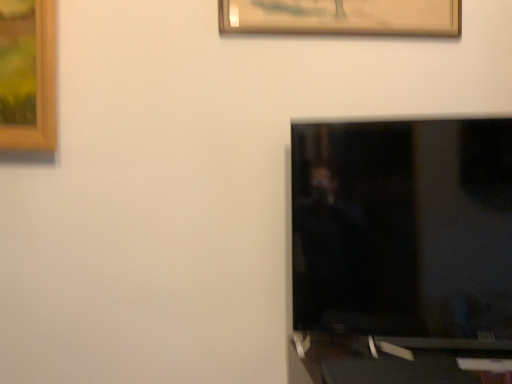
Image resolution: width=512 pixels, height=384 pixels. In order to click on black glossy tv at right in this screenshot , I will do `click(404, 229)`.

Image resolution: width=512 pixels, height=384 pixels. What do you see at coordinates (404, 229) in the screenshot?
I see `black glossy tv at right` at bounding box center [404, 229].

Identify the location of black glossy tv at right. This screenshot has height=384, width=512. (404, 229).